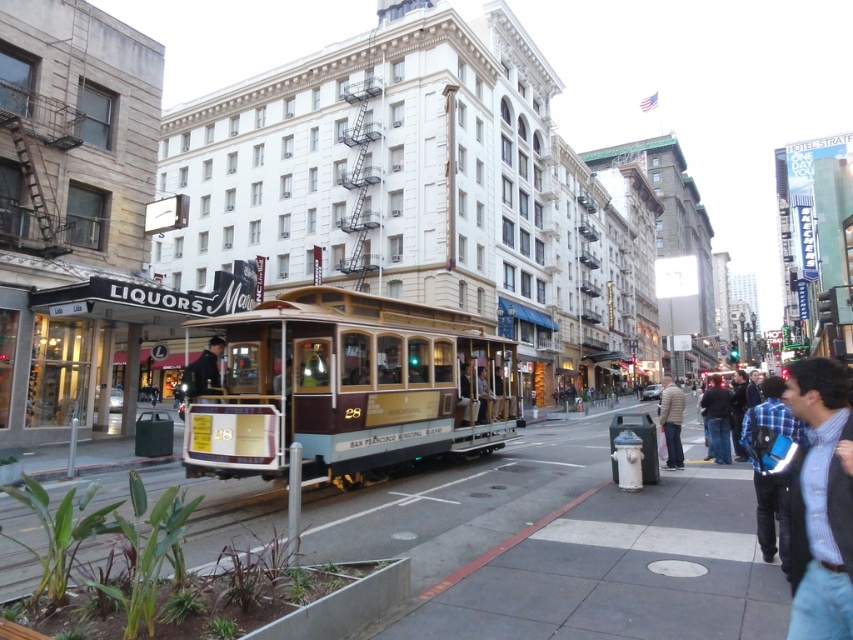
You are standing at the origin point of the image coordinate system. The cable car is located at coordinates 0.606 on the x axis and 0.410 on the y axis. If you want to walk directly towards the gold polished cable car at center, which direction should you head? Please answer with either north, south, east, or west.

Since the gold polished cable car at center is located at coordinates x 0.606 and y 0.410, you should head east because the x coordinate is greater than 0.5, indicating it is to the right side of the image, which corresponds to the east direction.

You are standing on the sidewalk and want to take a photo of the gold polished cable car at center. The camera you have can focus on objects up to 10 meters away. Will the cable car be in focus?

The gold polished cable car at center is 8.69 meters away from the camera. Since the camera can focus up to 10 meters, the cable car will be in focus.